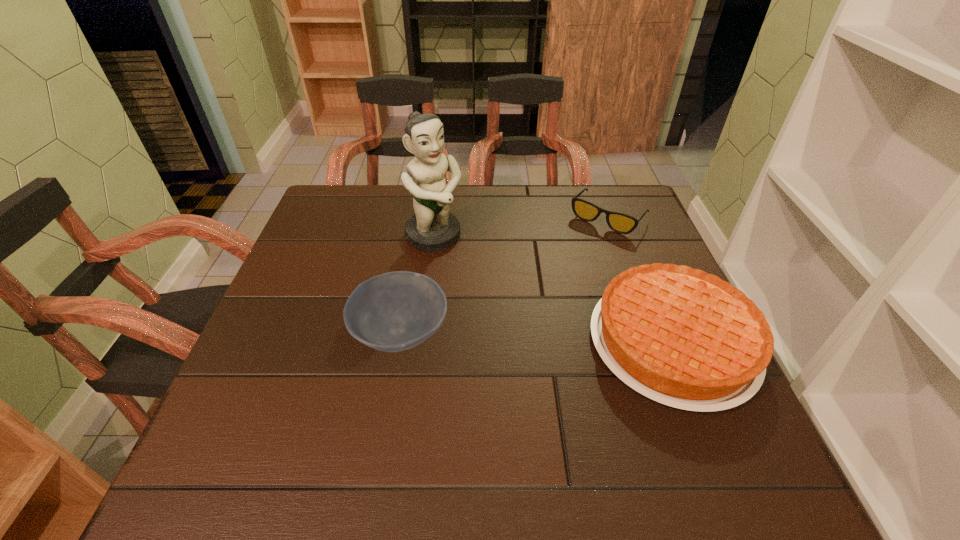
The image size is (960, 540). Find the location of `vacant space at the near edge of the desktop`. vacant space at the near edge of the desktop is located at coordinates [390, 402].

Identify the location of vacant space at the left edge of the desktop. (317, 285).

In the image, there is a desktop. Where is `blank space at the right edge`? blank space at the right edge is located at coordinates (632, 249).

In the image, there is a desktop. In order to click on free space at the far left corner in this screenshot , I will do `click(371, 203)`.

Identify the location of vacant space at the near left corner. The height and width of the screenshot is (540, 960). (272, 391).

Identify the location of vacant point at the far right corner. Image resolution: width=960 pixels, height=540 pixels. (597, 220).

Find the location of a particular element. The width and height of the screenshot is (960, 540). blank region between the bowl and the pie is located at coordinates (537, 338).

Locate an element on the screen. This screenshot has width=960, height=540. empty location between the tallest object and the sunglasses is located at coordinates (521, 227).

This screenshot has height=540, width=960. Find the location of `free space between the figurine and the sunglasses`. free space between the figurine and the sunglasses is located at coordinates (521, 227).

At what (x,y) coordinates should I click in order to perform the action: click on unoccupied position between the tallest object and the pie. Please return your answer as a coordinate pair (x, y). Looking at the image, I should click on (553, 289).